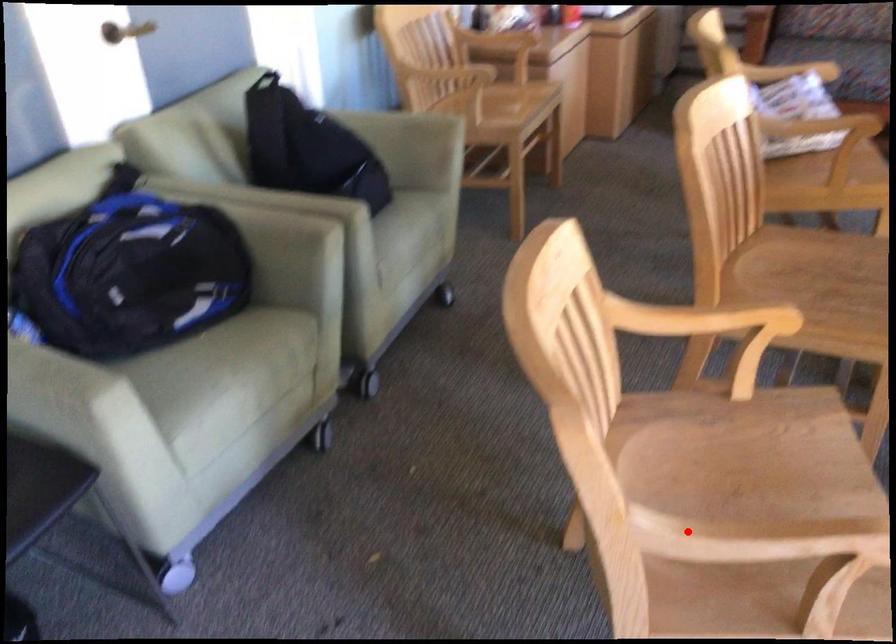
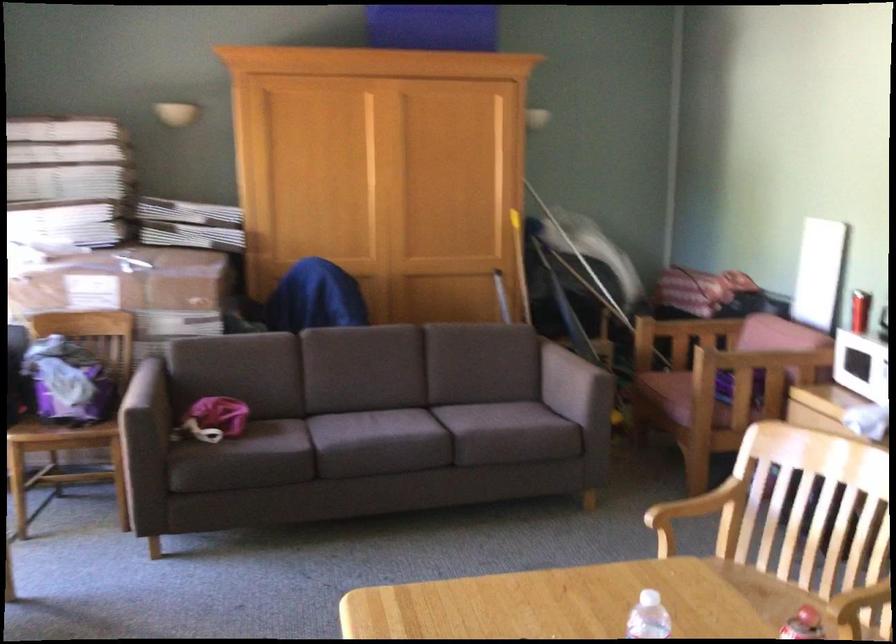
Where in the second image is the point corresponding to the highlighted location from the first image?

(694, 512)